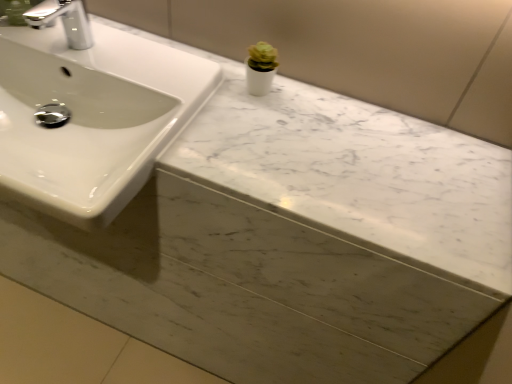
Question: Does silver metallic faucet at upper left have a lesser height compared to white marble counter top at upper center?

Choices:
 (A) yes
 (B) no

Answer: (B)

Question: Is silver metallic faucet at upper left turned away from white marble counter top at upper center?

Choices:
 (A) yes
 (B) no

Answer: (B)

Question: Considering the relative sizes of silver metallic faucet at upper left and white marble counter top at upper center in the image provided, is silver metallic faucet at upper left wider than white marble counter top at upper center?

Choices:
 (A) no
 (B) yes

Answer: (A)

Question: Is silver metallic faucet at upper left not within white marble counter top at upper center?

Choices:
 (A) no
 (B) yes

Answer: (B)

Question: From the image's perspective, is silver metallic faucet at upper left over white marble counter top at upper center?

Choices:
 (A) yes
 (B) no

Answer: (A)

Question: From a real-world perspective, is white glossy sink at upper left physically located above or below silver metallic faucet at upper left?

Choices:
 (A) below
 (B) above

Answer: (A)

Question: Is point (177, 115) positioned closer to the camera than point (55, 3)?

Choices:
 (A) closer
 (B) farther

Answer: (A)

Question: Looking at their shapes, would you say white glossy sink at upper left is wider or thinner than silver metallic faucet at upper left?

Choices:
 (A) wide
 (B) thin

Answer: (A)

Question: In the image, is white glossy sink at upper left on the left side or the right side of silver metallic faucet at upper left?

Choices:
 (A) left
 (B) right

Answer: (A)

Question: Is silver metallic faucet at upper left taller or shorter than white glossy sink at upper left?

Choices:
 (A) short
 (B) tall

Answer: (A)

Question: Is silver metallic faucet at upper left in front of or behind white glossy sink at upper left in the image?

Choices:
 (A) behind
 (B) front

Answer: (A)

Question: From the image's perspective, is silver metallic faucet at upper left positioned above or below white glossy sink at upper left?

Choices:
 (A) above
 (B) below

Answer: (A)

Question: Based on their sizes in the image, would you say silver metallic faucet at upper left is bigger or smaller than white glossy sink at upper left?

Choices:
 (A) small
 (B) big

Answer: (A)

Question: Is white glossy sink at upper left in front of or behind white marble counter top at upper center in the image?

Choices:
 (A) behind
 (B) front

Answer: (B)

Question: Is white glossy sink at upper left spatially inside white marble counter top at upper center, or outside of it?

Choices:
 (A) inside
 (B) outside

Answer: (B)